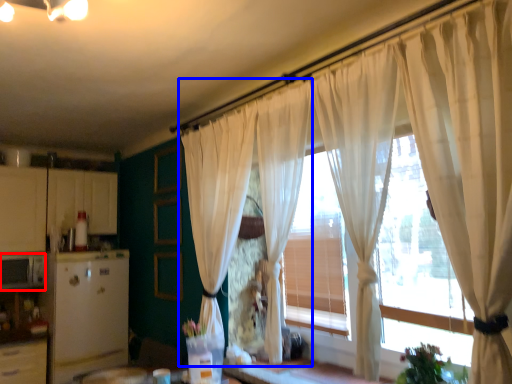
Question: Which object appears farthest to the camera in this image, appliance (highlighted by a red box) or curtain (highlighted by a blue box)?

Choices:
 (A) appliance
 (B) curtain

Answer: (A)